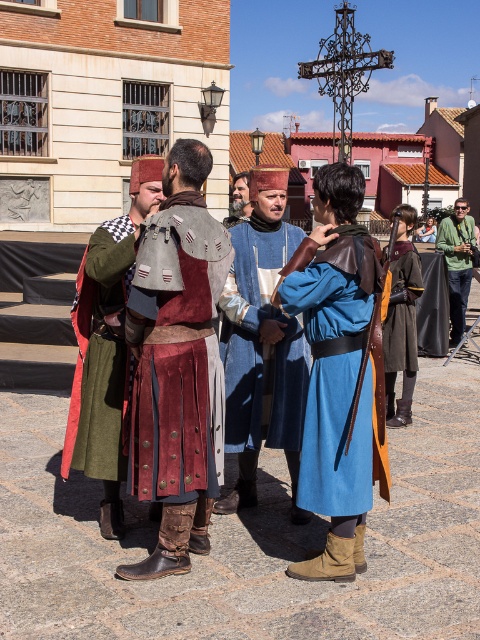
Who is more forward, (240, 328) or (468, 280)?

Point (240, 328)

Who is positioned more to the right, blue woolen tunic at center or green fabric jacket at right?

From the viewer's perspective, green fabric jacket at right appears more on the right side.

Is point (271, 216) positioned before point (465, 296)?

Yes, point (271, 216) is in front of point (465, 296).

You are a GUI agent. You are given a task and a screenshot of the screen. Output one action in this format:
    pyautogui.click(x=<x>, y=<y>)
    Task: Click on the blue woolen tunic at center
    The width and height of the screenshot is (480, 640).
    Given the screenshot: What is the action you would take?
    pyautogui.click(x=262, y=344)

Can you confirm if velvet brown tunic at center is smaller than green fabric jacket at right?

Actually, velvet brown tunic at center might be larger than green fabric jacket at right.

Between point (160, 246) and point (450, 220), which one is positioned in front?

Positioned in front is point (160, 246).

Identify the location of velvet brown tunic at center. Image resolution: width=480 pixels, height=640 pixels. (x=177, y=364).

Is point (298, 248) closer to viewer compared to point (283, 321)?

Yes, point (298, 248) is in front of point (283, 321).

Describe the element at coordinates (336, 369) in the screenshot. I see `blue woolen robe at center` at that location.

Who is more forward, (324,300) or (301,413)?

Point (324,300) is more forward.

Where is `blue woolen robe at center`? blue woolen robe at center is located at coordinates (336, 369).